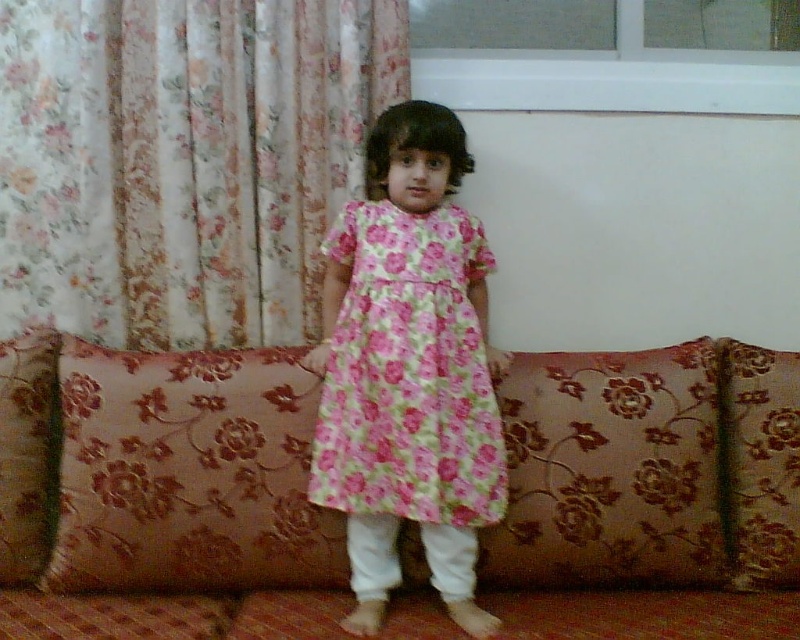
Can you confirm if brown floral cushion at center is thinner than floral fabric pillow at left?

Incorrect, brown floral cushion at center's width is not less than floral fabric pillow at left's.

Can you confirm if brown floral cushion at center is bigger than floral fabric pillow at left?

Correct, brown floral cushion at center is larger in size than floral fabric pillow at left.

Is point (709, 433) positioned before point (28, 524)?

No, it is behind (28, 524).

The image size is (800, 640). What are the coordinates of `brown floral cushion at center` in the screenshot? It's located at (609, 470).

Is floral fabric curtain at upper left to the right of floral fabric pillow at center from the viewer's perspective?

In fact, floral fabric curtain at upper left is to the left of floral fabric pillow at center.

Which is more to the left, floral fabric curtain at upper left or floral fabric pillow at center?

From the viewer's perspective, floral fabric curtain at upper left appears more on the left side.

Which is behind, point (262, 81) or point (764, 365)?

Point (262, 81)

Identify the location of floral fabric curtain at upper left. (182, 161).

Who is taller, brown floral cushion at center or floral cotton dress at center?

floral cotton dress at center is taller.

Is point (588, 490) closer to viewer compared to point (404, 486)?

That is False.

You are a GUI agent. You are given a task and a screenshot of the screen. Output one action in this format:
    pyautogui.click(x=<x>, y=<y>)
    Task: Click on the brown floral cushion at center
    
    Given the screenshot: What is the action you would take?
    pyautogui.click(x=609, y=470)